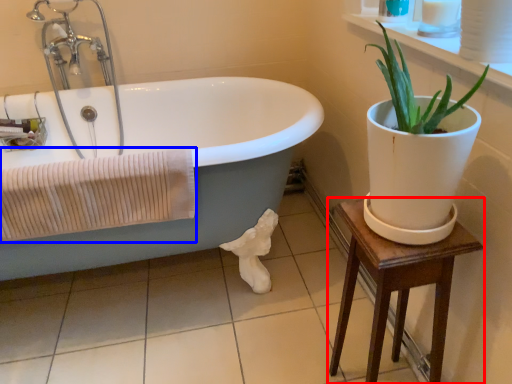
Question: Which object is closer to the camera taking this photo, table (highlighted by a red box) or bath towel (highlighted by a blue box)?

Choices:
 (A) table
 (B) bath towel

Answer: (A)